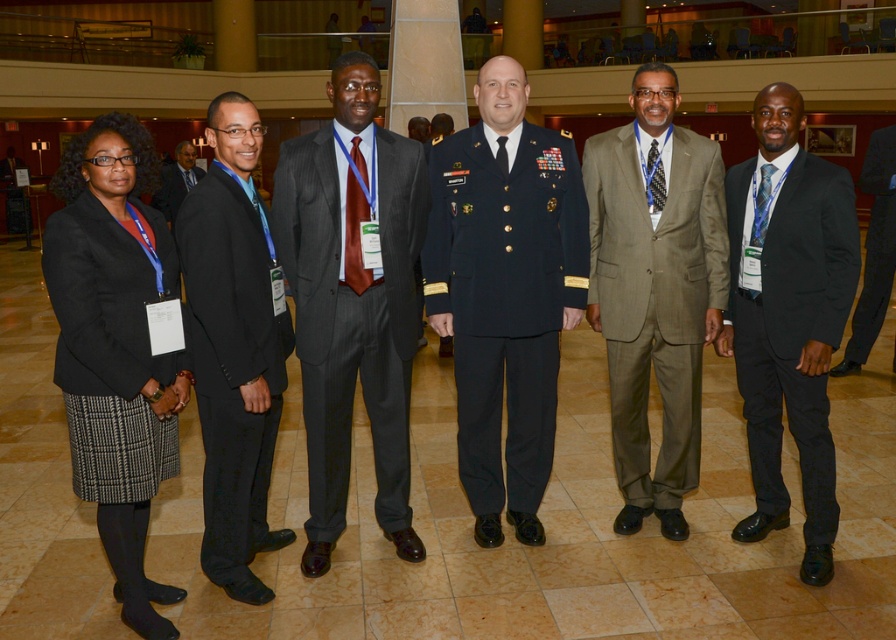
You are standing in the same room as the group of six people. You want to move from the position of point (696, 160) to the position of point (582, 205). Is the direction you need to move towards closer to the front or the back of the room?

The direction you need to move from point (696, 160) to point (582, 205) is towards the front of the room because point (582, 205) is in front of point (696, 160).

In the scene, there are two men wearing black suits. One is wearing a black satin suit at right and the other a black suit at left. From the perspective of someone standing in front of them, which man is positioned to the right of the other?

The black satin suit at right is positioned to the right of the black suit at left.